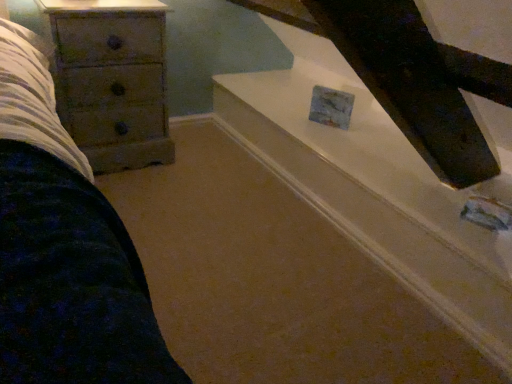
Question: Does wooden chest of drawers at left appear on the left side of white glossy stairwell at upper center?

Choices:
 (A) no
 (B) yes

Answer: (B)

Question: Could you tell me if wooden chest of drawers at left is turned towards white glossy stairwell at upper center?

Choices:
 (A) yes
 (B) no

Answer: (B)

Question: Considering the relative positions of wooden chest of drawers at left and white glossy stairwell at upper center in the image provided, is wooden chest of drawers at left in front of white glossy stairwell at upper center?

Choices:
 (A) yes
 (B) no

Answer: (B)

Question: From the image's perspective, is wooden chest of drawers at left above white glossy stairwell at upper center?

Choices:
 (A) no
 (B) yes

Answer: (B)

Question: Is wooden chest of drawers at left turned away from white glossy stairwell at upper center?

Choices:
 (A) no
 (B) yes

Answer: (A)

Question: Can you confirm if wooden chest of drawers at left is taller than white glossy stairwell at upper center?

Choices:
 (A) no
 (B) yes

Answer: (B)

Question: Could wooden chest of drawers at left be considered to be inside white glossy stairwell at upper center?

Choices:
 (A) yes
 (B) no

Answer: (B)

Question: Does white glossy stairwell at upper center have a greater height compared to wooden chest of drawers at left?

Choices:
 (A) no
 (B) yes

Answer: (A)

Question: Is white glossy stairwell at upper center facing away from wooden chest of drawers at left?

Choices:
 (A) yes
 (B) no

Answer: (B)

Question: Is there a large distance between white glossy stairwell at upper center and wooden chest of drawers at left?

Choices:
 (A) yes
 (B) no

Answer: (B)

Question: Is white glossy stairwell at upper center touching wooden chest of drawers at left?

Choices:
 (A) yes
 (B) no

Answer: (B)

Question: From the image's perspective, is white glossy stairwell at upper center under wooden chest of drawers at left?

Choices:
 (A) no
 (B) yes

Answer: (B)

Question: From a real-world perspective, is wooden chest of drawers at left positioned above or below white glossy stairwell at upper center?

Choices:
 (A) above
 (B) below

Answer: (A)